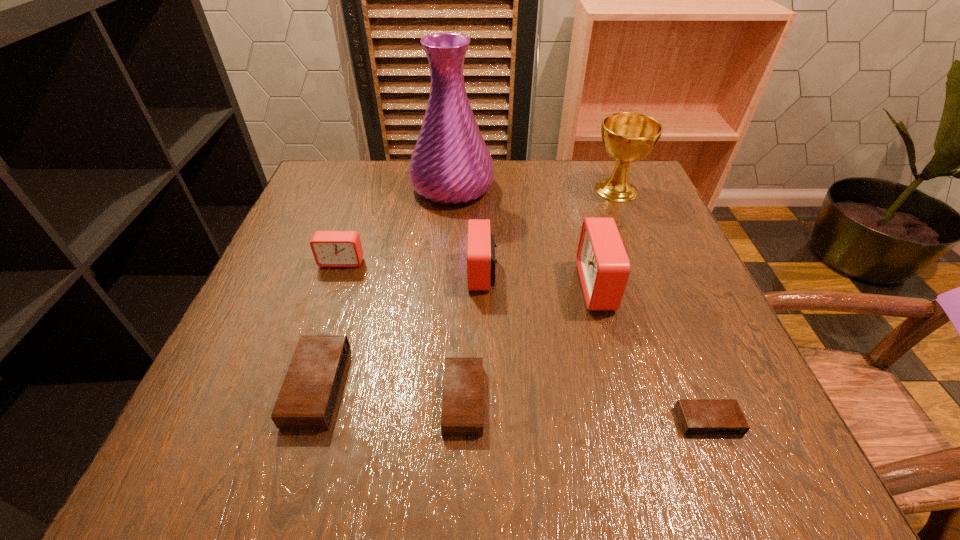
This screenshot has height=540, width=960. What are the coordinates of `vacant space that is in between the fourth tallest object and the second black alarm clock from left to right` in the screenshot? It's located at (472, 336).

The width and height of the screenshot is (960, 540). What are the coordinates of `free space between the gold chalice and the second red alarm clock from right to left` in the screenshot? It's located at (549, 231).

The width and height of the screenshot is (960, 540). In order to click on free space between the tallest object and the second black alarm clock from right to left in this screenshot , I will do `click(458, 293)`.

You are a GUI agent. You are given a task and a screenshot of the screen. Output one action in this format:
    pyautogui.click(x=<x>, y=<y>)
    Task: Click on the vacant space in between the second red alarm clock from left to right and the seventh tallest object
    
    Given the screenshot: What is the action you would take?
    pyautogui.click(x=472, y=336)

Find the location of `empty location between the rightmost red alarm clock and the biggest black alarm clock`. empty location between the rightmost red alarm clock and the biggest black alarm clock is located at coordinates (458, 336).

Where is `free point between the fifth tallest alarm clock and the vase`? This screenshot has height=540, width=960. free point between the fifth tallest alarm clock and the vase is located at coordinates (458, 293).

Find the location of a particular element. This screenshot has height=540, width=960. free spot between the second red alarm clock from right to left and the fifth alarm clock from left to right is located at coordinates (540, 279).

Find the location of a particular element. free space between the shortest object and the gold chalice is located at coordinates (662, 306).

Identify which object is the nearest to the tallest object. Please provide its 2D coordinates. Your answer should be formatted as a tuple, i.e. [(x, y)], where the tuple contains the x and y coordinates of a point satisfying the conditions above.

[(481, 245)]

Locate which object is the fifth closest to the gold chalice. Please provide its 2D coordinates. Your answer should be formatted as a tuple, i.e. [(x, y)], where the tuple contains the x and y coordinates of a point satisfying the conditions above.

[(462, 406)]